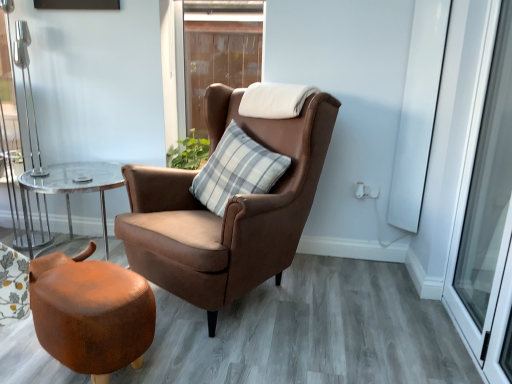
Question: From a real-world perspective, is brown wooden window at upper center on gray striped cushion at center?

Choices:
 (A) yes
 (B) no

Answer: (A)

Question: Is brown wooden window at upper center positioned beyond the bounds of gray striped cushion at center?

Choices:
 (A) yes
 (B) no

Answer: (A)

Question: Are brown wooden window at upper center and gray striped cushion at center beside each other?

Choices:
 (A) yes
 (B) no

Answer: (B)

Question: Is brown wooden window at upper center looking in the opposite direction of gray striped cushion at center?

Choices:
 (A) no
 (B) yes

Answer: (A)

Question: Is brown wooden window at upper center wider than gray striped cushion at center?

Choices:
 (A) yes
 (B) no

Answer: (B)

Question: From the image's perspective, is clear glass table at left above or below brown wooden window at upper center?

Choices:
 (A) below
 (B) above

Answer: (A)

Question: Is clear glass table at left inside or outside of brown wooden window at upper center?

Choices:
 (A) inside
 (B) outside

Answer: (B)

Question: Would you say clear glass table at left is to the left or to the right of brown wooden window at upper center in the picture?

Choices:
 (A) right
 (B) left

Answer: (B)

Question: Does point (69, 235) appear closer or farther from the camera than point (208, 43)?

Choices:
 (A) closer
 (B) farther

Answer: (A)

Question: In terms of size, does matte brown stool at lower left appear bigger or smaller than gray striped cushion at center?

Choices:
 (A) small
 (B) big

Answer: (A)

Question: In the image, is matte brown stool at lower left positioned in front of or behind gray striped cushion at center?

Choices:
 (A) front
 (B) behind

Answer: (A)

Question: In terms of height, does matte brown stool at lower left look taller or shorter compared to gray striped cushion at center?

Choices:
 (A) short
 (B) tall

Answer: (A)

Question: Choose the correct answer: Is matte brown stool at lower left inside gray striped cushion at center or outside it?

Choices:
 (A) inside
 (B) outside

Answer: (B)

Question: Considering the positions of point (230, 168) and point (197, 137), is point (230, 168) closer or farther from the camera than point (197, 137)?

Choices:
 (A) closer
 (B) farther

Answer: (A)

Question: Would you say gray striped cushion at center is inside or outside green leafy plant at upper center?

Choices:
 (A) outside
 (B) inside

Answer: (A)